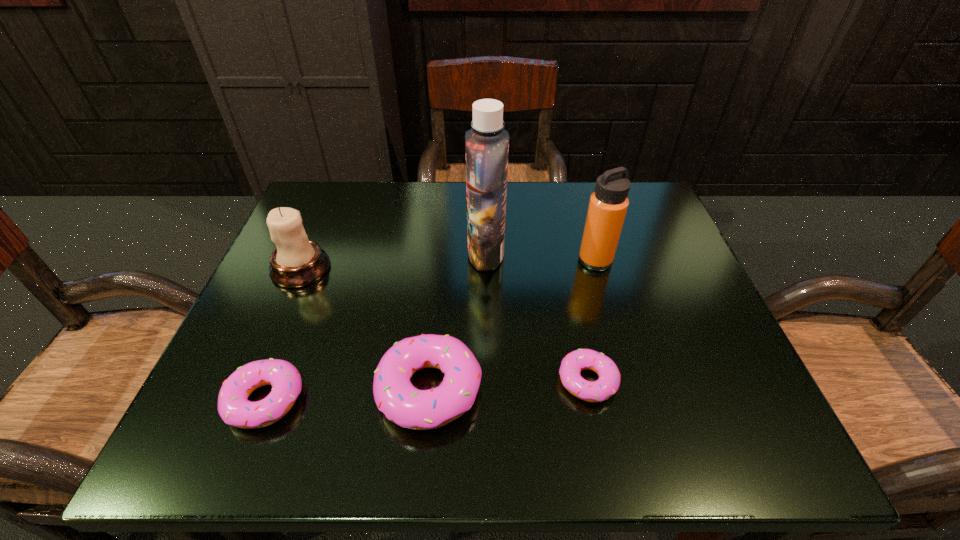
The image size is (960, 540). What are the coordinates of `vacant space in between the shortest doughnut and the third tallest object` in the screenshot? It's located at (444, 325).

At what (x,y) coordinates should I click in order to perform the action: click on free space that is in between the tallest object and the thermos bottle. Please return your answer as a coordinate pair (x, y). Looking at the image, I should click on (540, 256).

In order to click on free space between the second doughnut from left to right and the rightmost doughnut in this screenshot , I will do `click(509, 386)`.

The height and width of the screenshot is (540, 960). I want to click on free point between the shampoo and the rightmost doughnut, so click(x=537, y=317).

You are a GUI agent. You are given a task and a screenshot of the screen. Output one action in this format:
    pyautogui.click(x=<x>, y=<y>)
    Task: Click on the unoccupied area between the tallest object and the fifth shortest object
    
    Given the screenshot: What is the action you would take?
    pyautogui.click(x=540, y=256)

Select which object is the fourth closest to the shampoo. Please provide its 2D coordinates. Your answer should be formatted as a tuple, i.e. [(x, y)], where the tuple contains the x and y coordinates of a point satisfying the conditions above.

[(297, 261)]

Image resolution: width=960 pixels, height=540 pixels. Identify the location of object that is the fourth closest to the rightmost doughnut. (235, 409).

Find the location of `doughnut that is the closest to the shortest doughnut`. doughnut that is the closest to the shortest doughnut is located at coordinates (394, 394).

Locate an element on the screen. doughnut that is the second closest to the tallest doughnut is located at coordinates (608, 383).

Where is `vacant position in the image that satisfies the following two spatial constraints: 1. on the back side of the shortest doughnut; 2. on the right side of the second doughnut from left to right`? The image size is (960, 540). vacant position in the image that satisfies the following two spatial constraints: 1. on the back side of the shortest doughnut; 2. on the right side of the second doughnut from left to right is located at coordinates (430, 381).